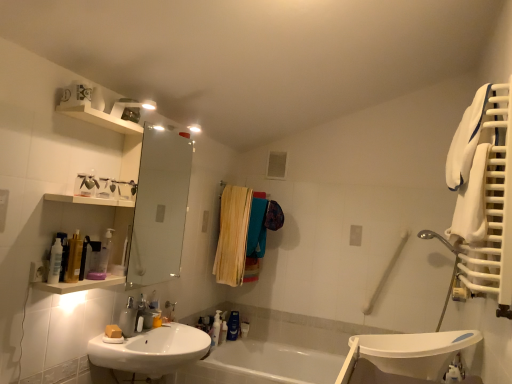
Question: From a real-world perspective, is matte yellow soap at sink left located beneath translucent plastic bottle at lower center, the second toiletry when ordered from right to left?

Choices:
 (A) yes
 (B) no

Answer: (B)

Question: Is matte yellow soap at sink left at the left side of translucent plastic bottle at lower center, acting as the second toiletry starting from the left?

Choices:
 (A) no
 (B) yes

Answer: (B)

Question: Can we say matte yellow soap at sink left lies outside translucent plastic bottle at lower center, acting as the second toiletry starting from the left?

Choices:
 (A) no
 (B) yes

Answer: (B)

Question: Considering the relative sizes of matte yellow soap at sink left and translucent plastic bottle at lower center, the second toiletry when ordered from right to left, in the image provided, is matte yellow soap at sink left shorter than translucent plastic bottle at lower center, the second toiletry when ordered from right to left,?

Choices:
 (A) no
 (B) yes

Answer: (B)

Question: Does matte yellow soap at sink left turn towards translucent plastic bottle at lower center, the second toiletry when ordered from right to left?

Choices:
 (A) no
 (B) yes

Answer: (B)

Question: Is matte yellow soap at sink left not near translucent plastic bottle at lower center, the second toiletry when ordered from right to left?

Choices:
 (A) yes
 (B) no

Answer: (A)

Question: Does matte silver soap dispenser at lower left have a greater width compared to wooden laundry at center?

Choices:
 (A) no
 (B) yes

Answer: (A)

Question: From the image's perspective, is matte silver soap dispenser at lower left located beneath wooden laundry at center?

Choices:
 (A) yes
 (B) no

Answer: (A)

Question: Considering the relative sizes of matte silver soap dispenser at lower left and wooden laundry at center in the image provided, is matte silver soap dispenser at lower left smaller than wooden laundry at center?

Choices:
 (A) yes
 (B) no

Answer: (A)

Question: Considering the relative sizes of matte silver soap dispenser at lower left and wooden laundry at center in the image provided, is matte silver soap dispenser at lower left taller than wooden laundry at center?

Choices:
 (A) no
 (B) yes

Answer: (A)

Question: Is matte silver soap dispenser at lower left thinner than wooden laundry at center?

Choices:
 (A) yes
 (B) no

Answer: (A)

Question: Considering the relative sizes of matte silver soap dispenser at lower left and wooden laundry at center in the image provided, is matte silver soap dispenser at lower left shorter than wooden laundry at center?

Choices:
 (A) no
 (B) yes

Answer: (B)

Question: Is metallic silver faucet at sink left positioned with its back to translucent plastic pump bottle at lower center, the third toiletry in the right-to-left sequence?

Choices:
 (A) yes
 (B) no

Answer: (B)